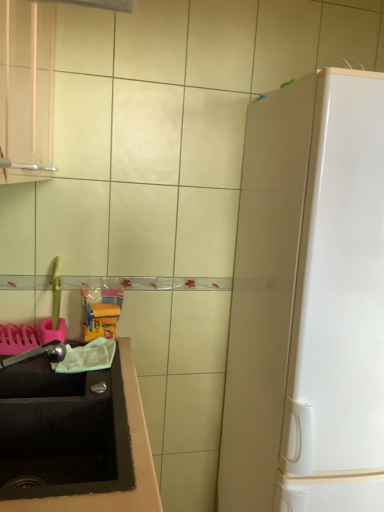
Question: Considering the relative sizes of satin nickel faucet at lower left and white glossy refrigerator at right in the image provided, is satin nickel faucet at lower left bigger than white glossy refrigerator at right?

Choices:
 (A) yes
 (B) no

Answer: (B)

Question: Is satin nickel faucet at lower left taller than white glossy refrigerator at right?

Choices:
 (A) no
 (B) yes

Answer: (A)

Question: Does satin nickel faucet at lower left come in front of white glossy refrigerator at right?

Choices:
 (A) yes
 (B) no

Answer: (B)

Question: Does satin nickel faucet at lower left appear on the right side of white glossy refrigerator at right?

Choices:
 (A) yes
 (B) no

Answer: (B)

Question: Could you tell me if satin nickel faucet at lower left is turned towards white glossy refrigerator at right?

Choices:
 (A) yes
 (B) no

Answer: (A)

Question: Is satin nickel faucet at lower left oriented away from white glossy refrigerator at right?

Choices:
 (A) no
 (B) yes

Answer: (A)

Question: Is black matte sink at lower left to the left of satin nickel faucet at lower left from the viewer's perspective?

Choices:
 (A) yes
 (B) no

Answer: (B)

Question: Is black matte sink at lower left positioned in front of satin nickel faucet at lower left?

Choices:
 (A) no
 (B) yes

Answer: (B)

Question: Does black matte sink at lower left have a larger size compared to satin nickel faucet at lower left?

Choices:
 (A) yes
 (B) no

Answer: (A)

Question: Is black matte sink at lower left oriented towards satin nickel faucet at lower left?

Choices:
 (A) yes
 (B) no

Answer: (B)

Question: Is black matte sink at lower left located outside satin nickel faucet at lower left?

Choices:
 (A) no
 (B) yes

Answer: (B)

Question: Is satin nickel faucet at lower left surrounded by black matte sink at lower left?

Choices:
 (A) yes
 (B) no

Answer: (B)

Question: Is satin nickel faucet at lower left wider than black matte sink at lower left?

Choices:
 (A) no
 (B) yes

Answer: (A)